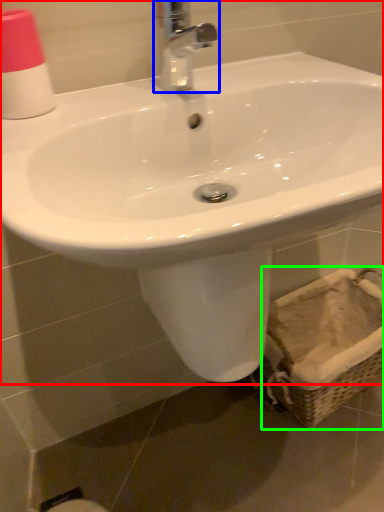
Question: Based on their relative distances, which object is farther from sink (highlighted by a red box)? Choose from tap (highlighted by a blue box) and basket (highlighted by a green box).

Choices:
 (A) tap
 (B) basket

Answer: (B)